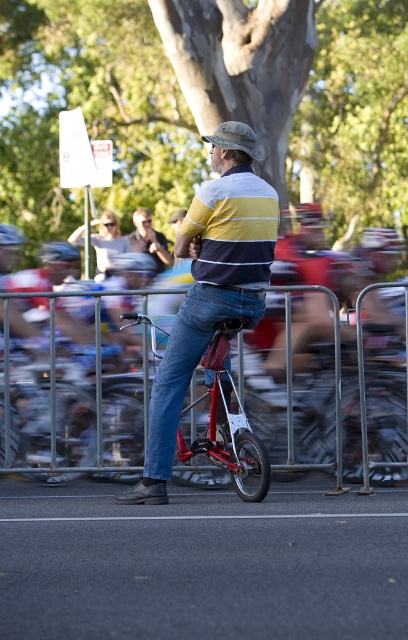
Which is more to the right, matte yellow and blue striped shirt at center or denim at center?

matte yellow and blue striped shirt at center is more to the right.

Does matte yellow and blue striped shirt at center have a greater width compared to denim at center?

Yes.

The image size is (408, 640). I want to click on matte yellow and blue striped shirt at center, so [x=210, y=285].

Does metallic silver fence at center have a lesser height compared to matte black sunglasses at upper center?

Indeed, metallic silver fence at center has a lesser height compared to matte black sunglasses at upper center.

Is point (361, 394) positioned in front of point (108, 221)?

Yes, point (361, 394) is in front of point (108, 221).

Identify the location of metallic silver fence at center. The width and height of the screenshot is (408, 640). (95, 355).

Which of these two, denim at center or matte black sunglasses at upper center, stands taller?

matte black sunglasses at upper center is taller.

Describe the element at coordinates (188, 364) in the screenshot. I see `denim at center` at that location.

Identify the location of denim at center. The height and width of the screenshot is (640, 408). (188, 364).